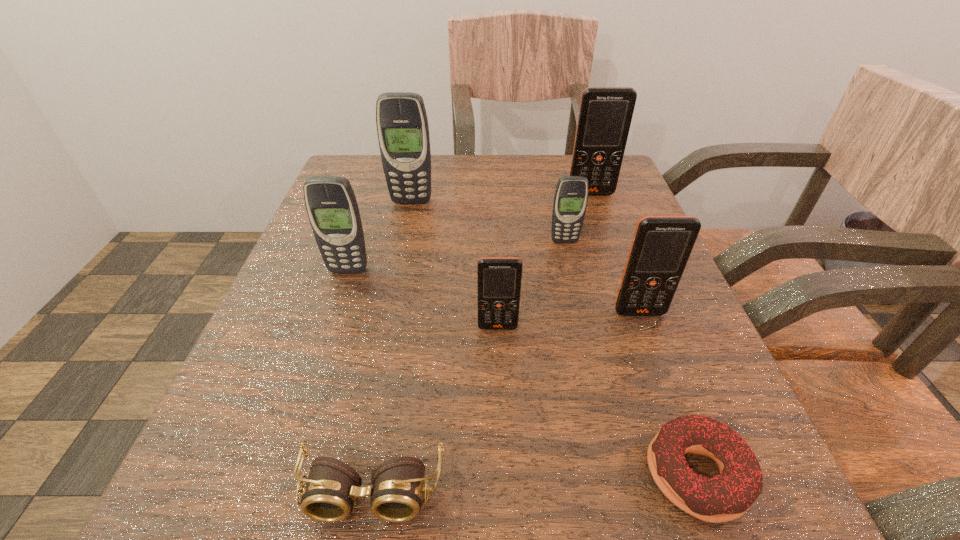
This screenshot has height=540, width=960. In order to click on vacant area between the second biggest orange cellular telephone and the brown goggles in this screenshot , I will do `click(506, 402)`.

Locate an element on the screen. blank region between the second farthest orange cellular telephone and the second farthest object is located at coordinates (525, 257).

You are a GUI agent. You are given a task and a screenshot of the screen. Output one action in this format:
    pyautogui.click(x=<x>, y=<y>)
    Task: Click on the empty space that is in between the shortest object and the farthest gray cellular telephone
    
    Given the screenshot: What is the action you would take?
    pyautogui.click(x=555, y=338)

Where is `empty space that is in between the brown goggles and the doughnut`? empty space that is in between the brown goggles and the doughnut is located at coordinates (535, 483).

Where is `vacant area between the shortest object and the second biggest orange cellular telephone`? The width and height of the screenshot is (960, 540). vacant area between the shortest object and the second biggest orange cellular telephone is located at coordinates (668, 393).

At what (x,y) coordinates should I click in order to perform the action: click on object that is the second closest to the farthest orange cellular telephone. Please return your answer as a coordinate pair (x, y). The height and width of the screenshot is (540, 960). Looking at the image, I should click on (402, 125).

Identify the location of object identified as the third closest to the farthest cellular telephone. (661, 246).

This screenshot has width=960, height=540. In order to click on the closest cellular telephone to the seventh tallest object in this screenshot , I will do `click(499, 279)`.

Where is `cellular telephone that is the closest to the goggles`? cellular telephone that is the closest to the goggles is located at coordinates (499, 279).

Identify which orange cellular telephone is the second closest to the farthest object. Please provide its 2D coordinates. Your answer should be formatted as a tuple, i.e. [(x, y)], where the tuple contains the x and y coordinates of a point satisfying the conditions above.

[(499, 279)]